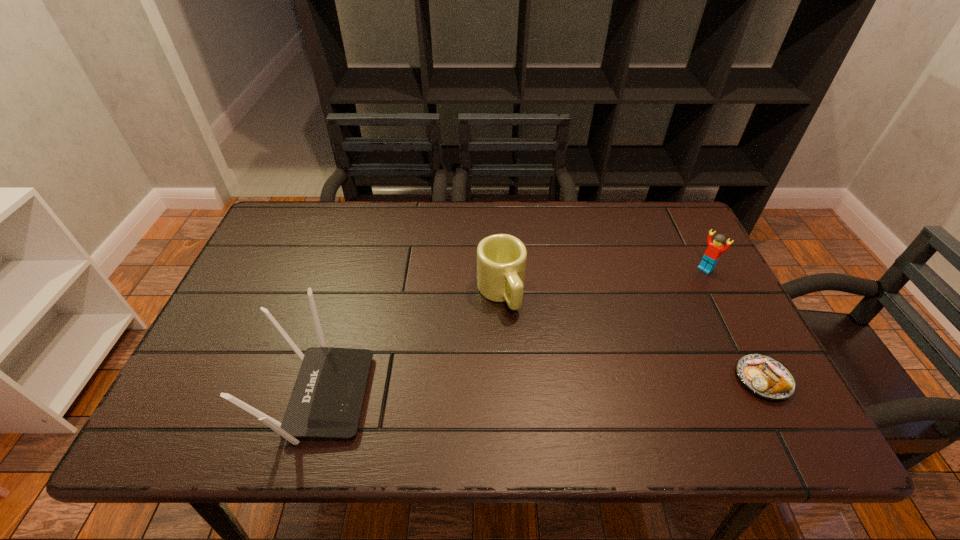
Where is `free space between the second object from left to right and the pastry`? Image resolution: width=960 pixels, height=540 pixels. free space between the second object from left to right and the pastry is located at coordinates (632, 335).

Find the location of a particular element. Image resolution: width=960 pixels, height=540 pixels. free space between the third object from right to left and the shortest object is located at coordinates (632, 335).

Where is `empty space between the tallest object and the third object from right to left`? This screenshot has width=960, height=540. empty space between the tallest object and the third object from right to left is located at coordinates (410, 343).

Find the location of a particular element. The width and height of the screenshot is (960, 540). object that is the second closest to the leftmost object is located at coordinates (765, 376).

Locate which object is the third closest to the tallest object. Please provide its 2D coordinates. Your answer should be formatted as a tuple, i.e. [(x, y)], where the tuple contains the x and y coordinates of a point satisfying the conditions above.

[(715, 248)]

The width and height of the screenshot is (960, 540). In order to click on vacant point that satisfies the following two spatial constraints: 1. on the front side of the mug; 2. on the left side of the shortest object in this screenshot , I will do `click(505, 379)`.

The width and height of the screenshot is (960, 540). I want to click on free space that satisfies the following two spatial constraints: 1. on the back side of the third object from right to left; 2. on the left side of the Lego, so click(x=499, y=268).